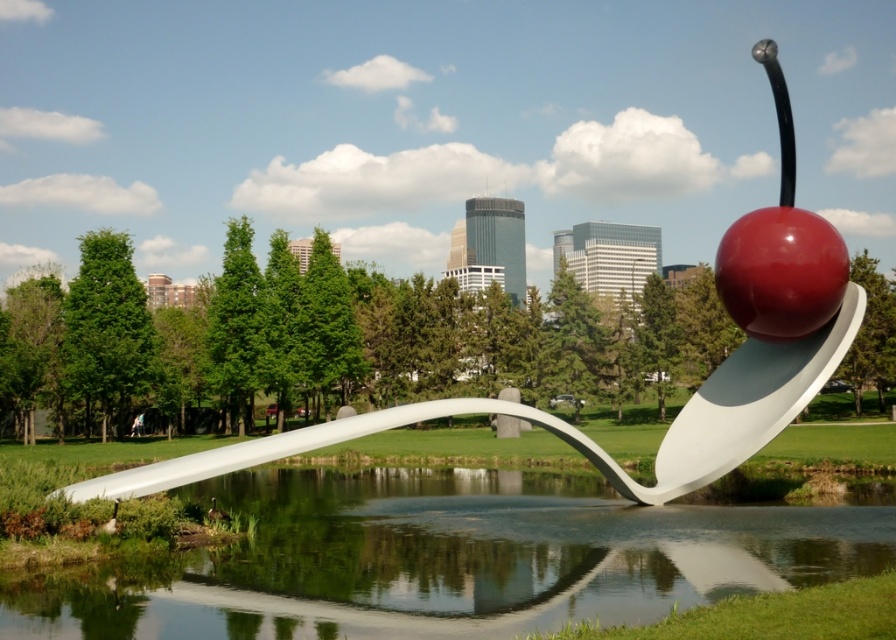
Is white glossy spoon at center thinner than glossy red cherry at upper right?

No.

Is white glossy spoon at center further to the viewer compared to glossy red cherry at upper right?

No.

Describe the element at coordinates (694, 394) in the screenshot. I see `white glossy spoon at center` at that location.

Where is `white glossy spoon at center`? Image resolution: width=896 pixels, height=640 pixels. white glossy spoon at center is located at coordinates (694, 394).

Does transparent water at spoon center appear over glossy red cherry at upper right?

No, transparent water at spoon center is not above glossy red cherry at upper right.

Who is more distant from viewer, (540, 557) or (784, 321)?

Point (784, 321)

Identify the location of transparent water at spoon center. (452, 557).

Does transparent water at spoon center have a smaller size compared to white glossy spoon at center?

Indeed, transparent water at spoon center has a smaller size compared to white glossy spoon at center.

Does point (866, 488) come closer to viewer compared to point (669, 454)?

No.

Image resolution: width=896 pixels, height=640 pixels. What do you see at coordinates (452, 557) in the screenshot?
I see `transparent water at spoon center` at bounding box center [452, 557].

Image resolution: width=896 pixels, height=640 pixels. Identify the location of transparent water at spoon center. (452, 557).